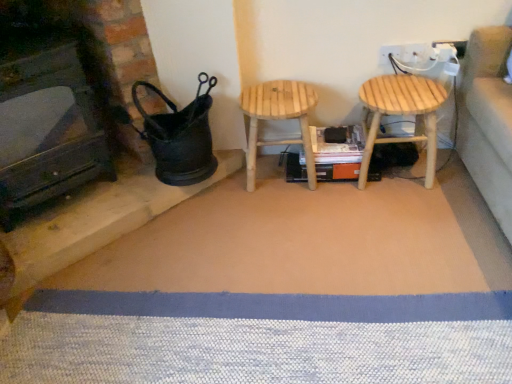
Question: Considering the positions of point (72, 183) and point (266, 107), is point (72, 183) closer or farther from the camera than point (266, 107)?

Choices:
 (A) closer
 (B) farther

Answer: (B)

Question: Is black matte fireplace at left inside the boundaries of natural wood stool at center, which is counted as the 2th stool, starting from the right, or outside?

Choices:
 (A) inside
 (B) outside

Answer: (B)

Question: Estimate the real-world distances between objects in this image. Which object is farther from the black matte fireplace at left?

Choices:
 (A) natural wood stool at center, which is counted as the 2th stool, starting from the right
 (B) natural wood stool at right, arranged as the second stool when viewed from the left

Answer: (B)

Question: Which object is the closest to the natural wood stool at right, arranged as the second stool when viewed from the left?

Choices:
 (A) natural wood stool at center, marked as the 1th stool in a left-to-right arrangement
 (B) black matte fireplace at left

Answer: (A)